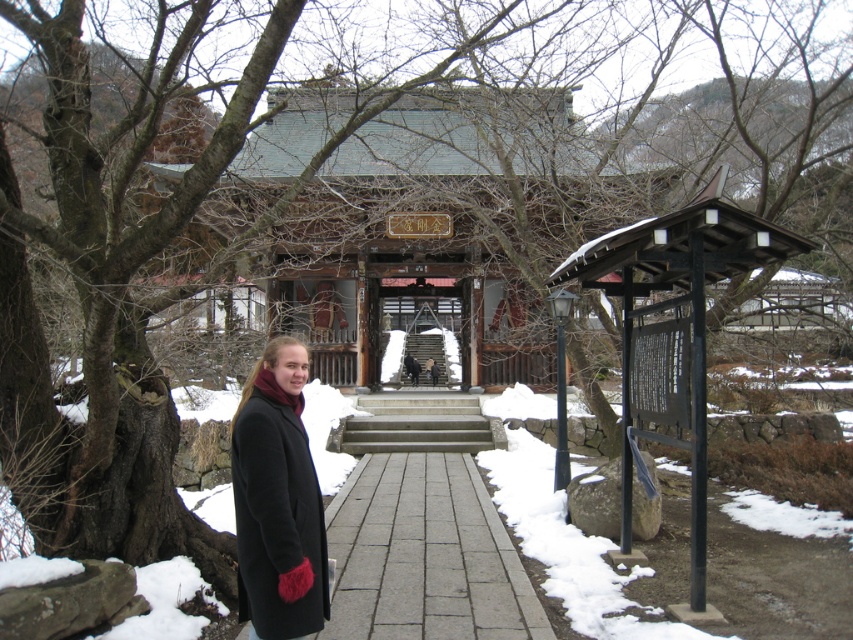
Does gray stone path at center have a larger size compared to black wool coat at center?

No, gray stone path at center is not bigger than black wool coat at center.

Is point (543, 616) closer to camera compared to point (268, 522)?

That is False.

This screenshot has height=640, width=853. Identify the location of gray stone path at center. (425, 556).